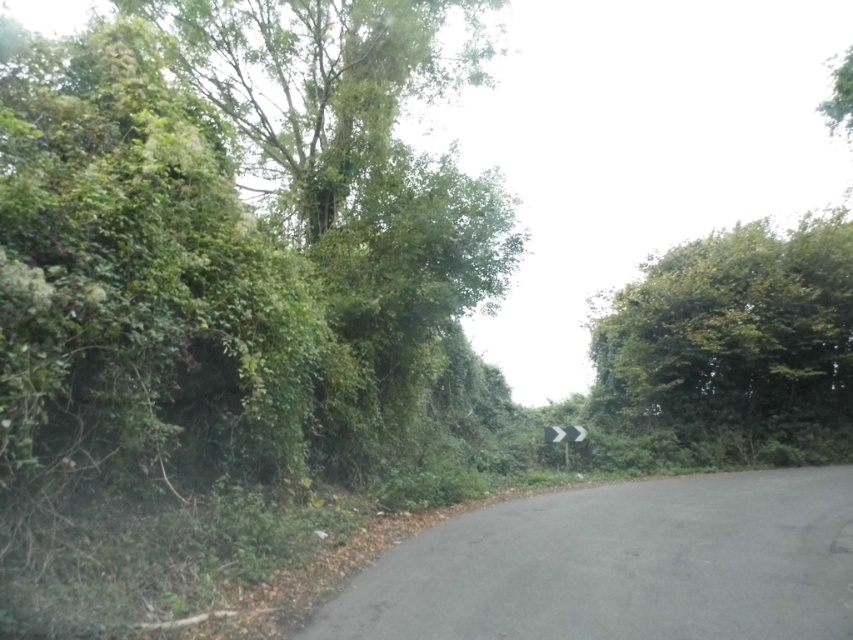
Is green leafy tree at right bigger than white plastic sign at center?

No.

Is green leafy tree at right positioned at the back of white plastic sign at center?

Yes, green leafy tree at right is further from the viewer.

Between point (776, 412) and point (569, 442), which one is positioned behind?

Point (776, 412)

In order to click on green leafy tree at right in this screenshot , I will do `click(735, 342)`.

From the picture: Is green leafy tree at upper left to the right of green leafy tree at right from the viewer's perspective?

No, green leafy tree at upper left is not to the right of green leafy tree at right.

Can you confirm if green leafy tree at upper left is bigger than green leafy tree at right?

Yes.

Identify the location of green leafy tree at upper left. Image resolution: width=853 pixels, height=640 pixels. (227, 241).

Where is `green leafy tree at upper left`? The image size is (853, 640). green leafy tree at upper left is located at coordinates (227, 241).

Who is more forward, (206, 337) or (555, 428)?

Point (206, 337) is more forward.

Is green leafy tree at upper left further to camera compared to white plastic sign at center?

No, it is in front of white plastic sign at center.

The height and width of the screenshot is (640, 853). What do you see at coordinates (227, 241) in the screenshot?
I see `green leafy tree at upper left` at bounding box center [227, 241].

You are a GUI agent. You are given a task and a screenshot of the screen. Output one action in this format:
    pyautogui.click(x=<x>, y=<y>)
    Task: Click on the green leafy tree at upper left
    The image size is (853, 640).
    Given the screenshot: What is the action you would take?
    pyautogui.click(x=227, y=241)